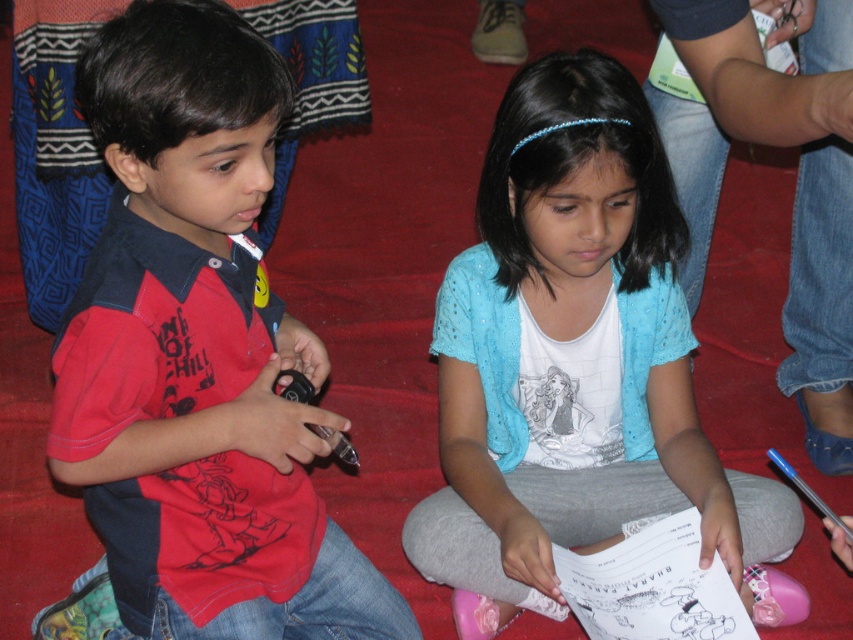
Between red matte shirt at left and blue cotton shirt at center, which one is positioned lower?

blue cotton shirt at center is lower down.

Between red matte shirt at left and blue cotton shirt at center, which one has more height?

blue cotton shirt at center is taller.

Image resolution: width=853 pixels, height=640 pixels. What are the coordinates of `red matte shirt at left` in the screenshot? It's located at (198, 353).

You are a GUI agent. You are given a task and a screenshot of the screen. Output one action in this format:
    pyautogui.click(x=<x>, y=<y>)
    Task: Click on the red matte shirt at left
    This screenshot has width=853, height=640.
    Given the screenshot: What is the action you would take?
    pyautogui.click(x=198, y=353)